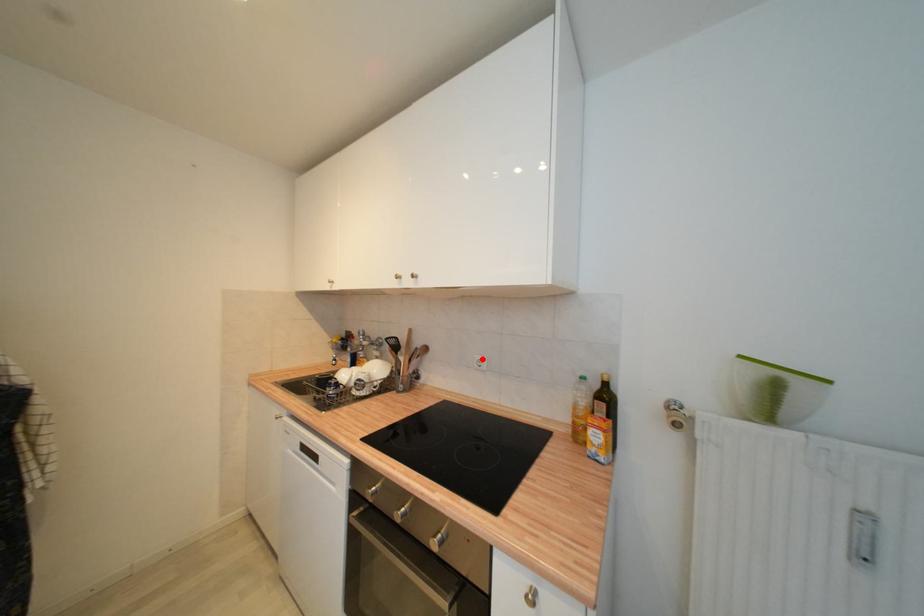
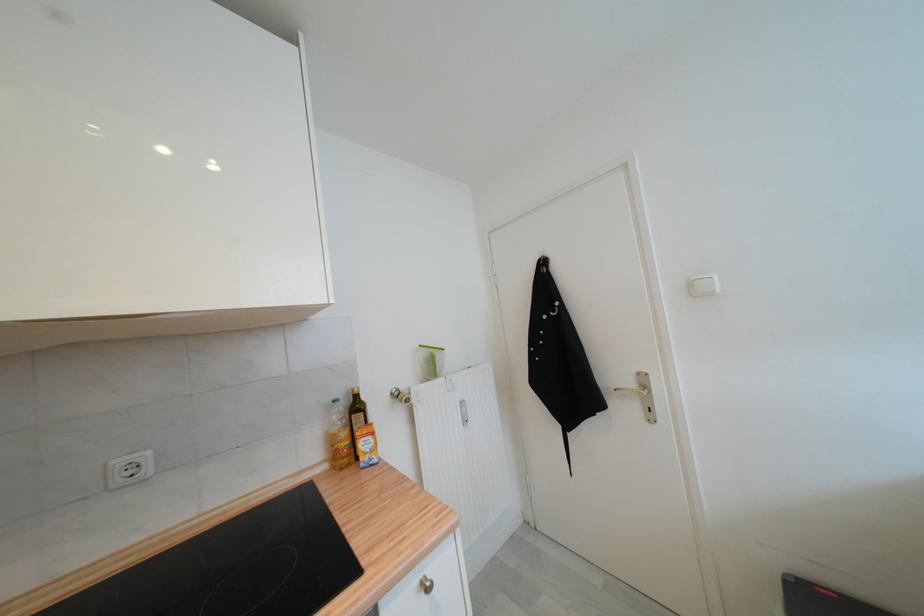
Where in the second image is the point corresponding to the highlighted location from the first image?

(126, 464)